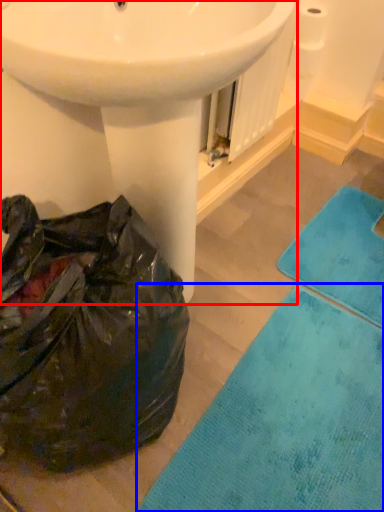
Question: Among these objects, which one is farthest to the camera, sink (highlighted by a red box) or bath mat (highlighted by a blue box)?

Choices:
 (A) sink
 (B) bath mat

Answer: (B)